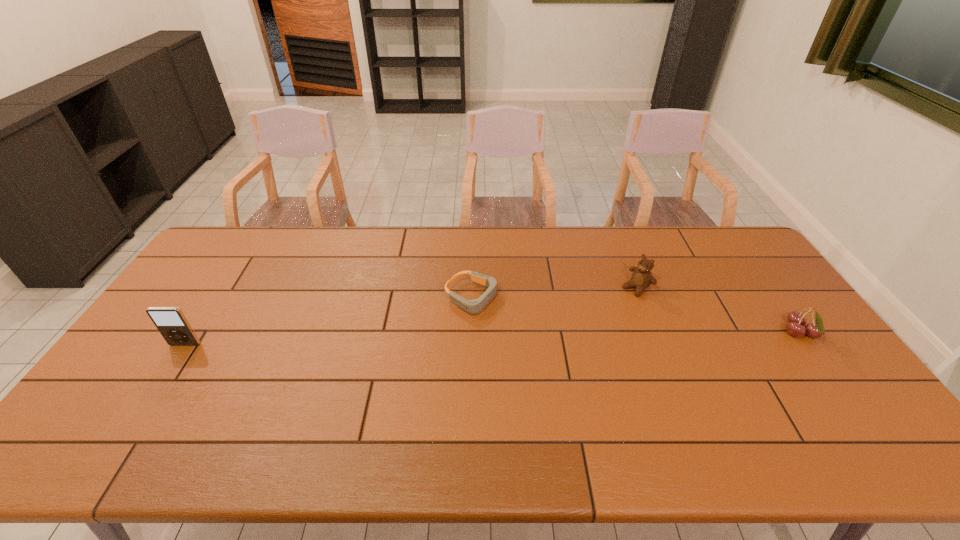
You are a GUI agent. You are given a task and a screenshot of the screen. Output one action in this format:
    pyautogui.click(x=<x>, y=<y>)
    Task: Click on the tallest object
    
    Given the screenshot: What is the action you would take?
    pyautogui.click(x=170, y=321)

You are a GUI agent. You are given a task and a screenshot of the screen. Output one action in this format:
    pyautogui.click(x=<x>, y=<y>)
    Task: Click on the iPod
    The height and width of the screenshot is (540, 960).
    Given the screenshot: What is the action you would take?
    pyautogui.click(x=170, y=321)

This screenshot has height=540, width=960. I want to click on cherry, so click(x=796, y=320).

The height and width of the screenshot is (540, 960). I want to click on the second shortest object, so click(x=796, y=320).

This screenshot has width=960, height=540. I want to click on the third object from left to right, so click(642, 278).

Identify the location of the second tallest object. The width and height of the screenshot is (960, 540). 642,278.

You are a GUI agent. You are given a task and a screenshot of the screen. Output one action in this format:
    pyautogui.click(x=<x>, y=<y>)
    Task: Click on the shortest object
    The image size is (960, 540).
    Given the screenshot: What is the action you would take?
    pyautogui.click(x=474, y=306)

Where is `goggles`? The width and height of the screenshot is (960, 540). goggles is located at coordinates (474, 306).

This screenshot has width=960, height=540. I want to click on vacant space located 0.170m on the front-facing side of the leftmost object, so click(150, 399).

This screenshot has width=960, height=540. Identify the location of free space located 0.400m at the face of the third shortest object. (540, 359).